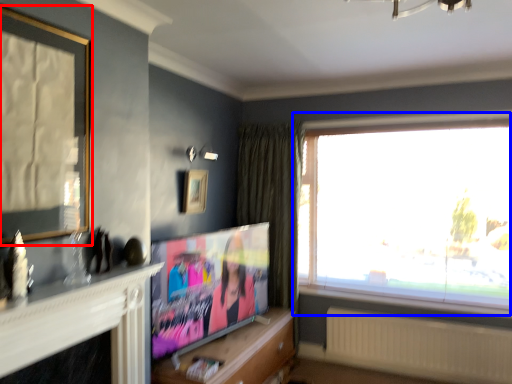
Question: Which point is closer to the camera, picture frame (highlighted by a red box) or window (highlighted by a blue box)?

Choices:
 (A) picture frame
 (B) window

Answer: (A)